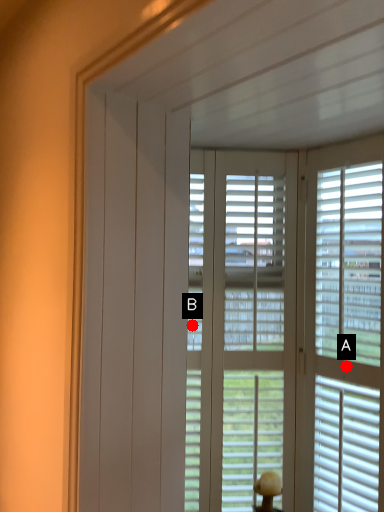
Question: Two points are circled on the image, labeled by A and B beside each circle. Which point is farther to the camera?

Choices:
 (A) A is further
 (B) B is further

Answer: (B)